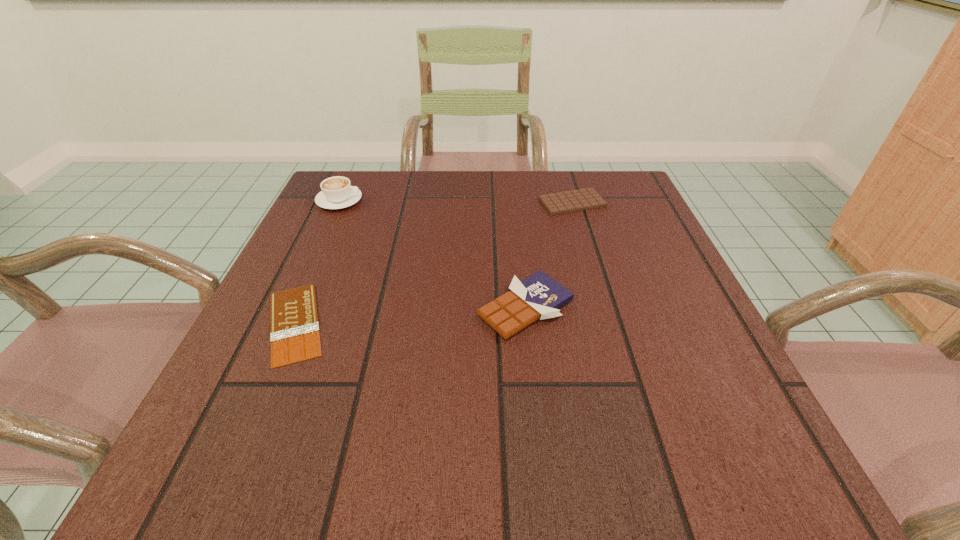
This screenshot has height=540, width=960. Find the location of `free point between the third tallest object and the tallest object`. free point between the third tallest object and the tallest object is located at coordinates (456, 201).

Locate an element on the screen. This screenshot has height=540, width=960. free space between the farthest chocolate bar and the shortest chocolate bar is located at coordinates (434, 263).

This screenshot has height=540, width=960. I want to click on vacant space that is in between the shortest object and the farthest chocolate bar, so tap(434, 263).

Locate an element on the screen. Image resolution: width=960 pixels, height=540 pixels. free spot between the cappuccino and the farthest chocolate bar is located at coordinates (456, 201).

At what (x,y) coordinates should I click in order to perform the action: click on empty space between the second tallest chocolate bar and the shortest object. Please return your answer as a coordinate pair (x, y). The height and width of the screenshot is (540, 960). Looking at the image, I should click on (434, 263).

This screenshot has height=540, width=960. In order to click on object that can be found as the third closest to the tallest object in this screenshot , I will do `click(582, 199)`.

Identify which object is the second closest to the farthest chocolate bar. Please provide its 2D coordinates. Your answer should be formatted as a tuple, i.e. [(x, y)], where the tuple contains the x and y coordinates of a point satisfying the conditions above.

[(337, 192)]

Where is `chocolate bar that is the closest to the farthest chocolate bar`? Image resolution: width=960 pixels, height=540 pixels. chocolate bar that is the closest to the farthest chocolate bar is located at coordinates (539, 296).

The width and height of the screenshot is (960, 540). I want to click on chocolate bar that is the closest to the second tallest object, so click(x=582, y=199).

Where is `vacant point that satisfies the following two spatial constraints: 1. on the back side of the third shortest object; 2. on the left side of the second shortest chocolate bar`? vacant point that satisfies the following two spatial constraints: 1. on the back side of the third shortest object; 2. on the left side of the second shortest chocolate bar is located at coordinates [x=514, y=202].